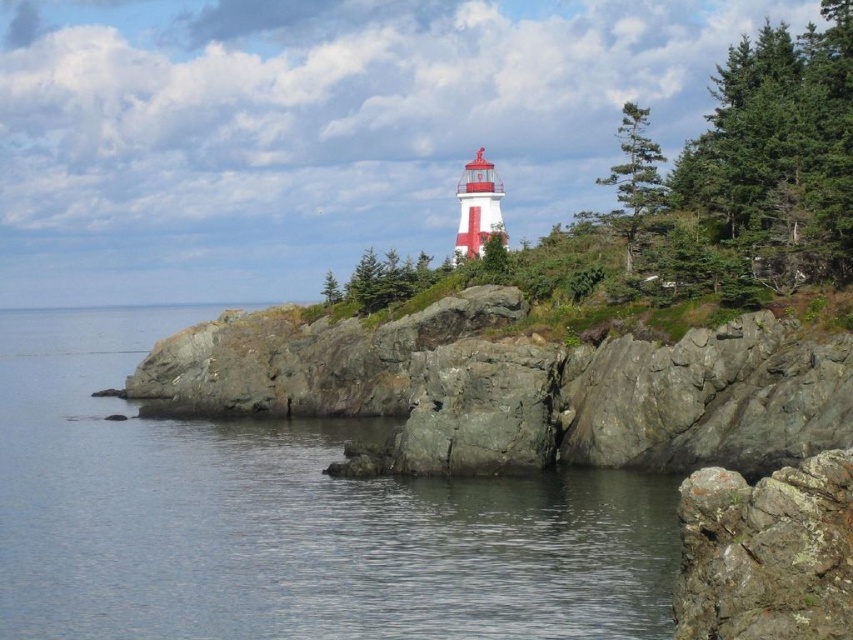
You are standing at the base of the lighthouse and want to walk from the transparent water at lower left to the green textured tree at upper right. What is the approximate distance you need to cover?

The distance between the transparent water at lower left and the green textured tree at upper right is approximately 55.91 meters.

You are a bird flying over the coastal scene and want to land on the nearest object. Which object would you choose between the transparent water at lower left and the green textured tree at upper right?

The green textured tree at upper right is taller than the transparent water at lower left, so the bird should land on the green textured tree at upper right because it is higher up.